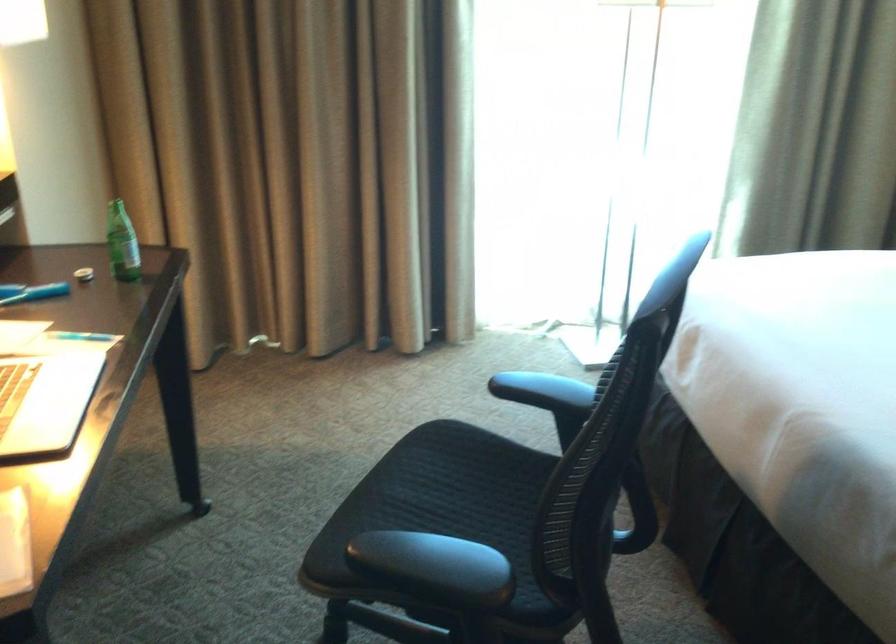
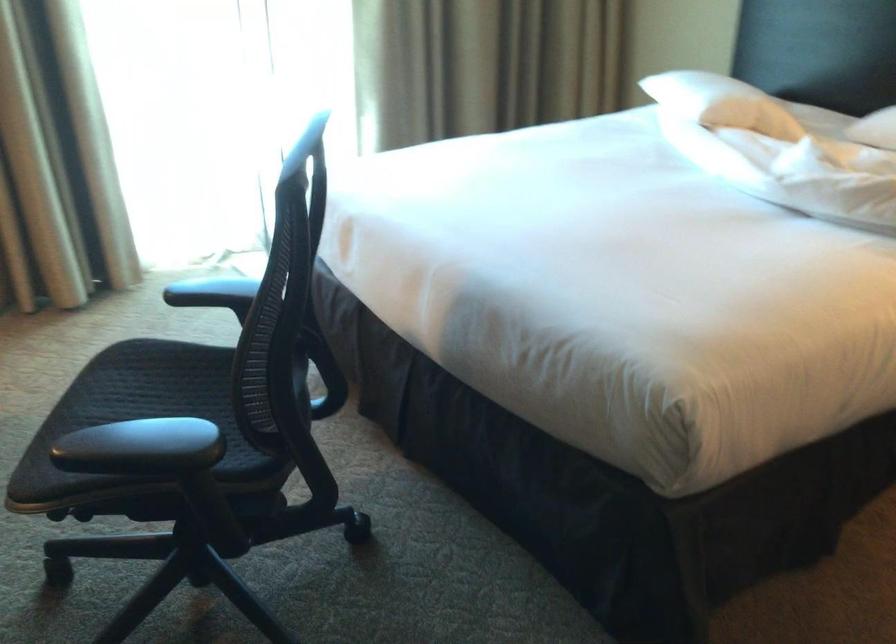
Question: Which direction would the cameraman need to move to produce the second image? Reply with the corresponding letter.

Choices:
 (A) Left
 (B) Right
 (C) Forward
 (D) Backward

Answer: (D)